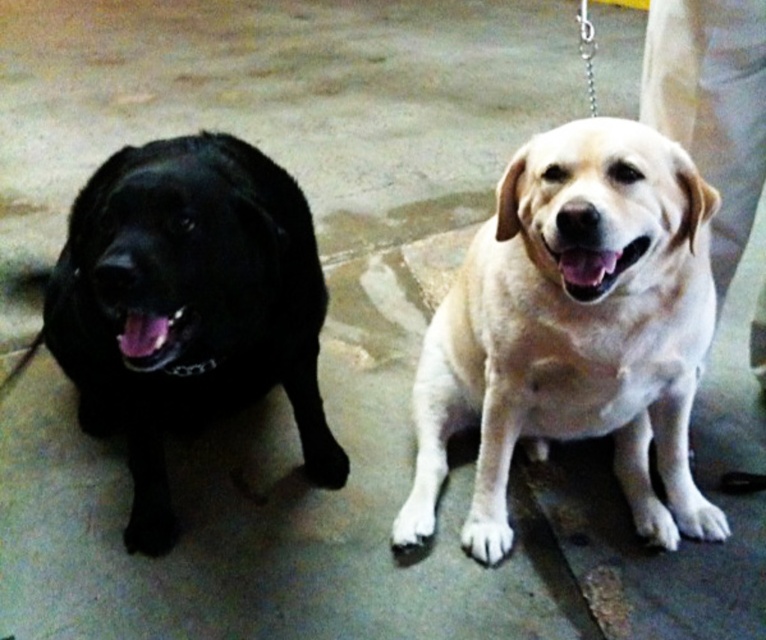
Question: Is light beige fur dog at center in front of matte black dog at left?

Choices:
 (A) no
 (B) yes

Answer: (B)

Question: Where is light beige fur dog at center located in relation to matte black dog at left in the image?

Choices:
 (A) below
 (B) above

Answer: (B)

Question: Which of the following is the closest to the observer?

Choices:
 (A) (169, 208)
 (B) (611, 269)

Answer: (B)

Question: Which point is closer to the camera taking this photo?

Choices:
 (A) (224, 211)
 (B) (663, 433)

Answer: (A)

Question: Does light beige fur dog at center appear on the left side of matte black dog at left?

Choices:
 (A) yes
 (B) no

Answer: (B)